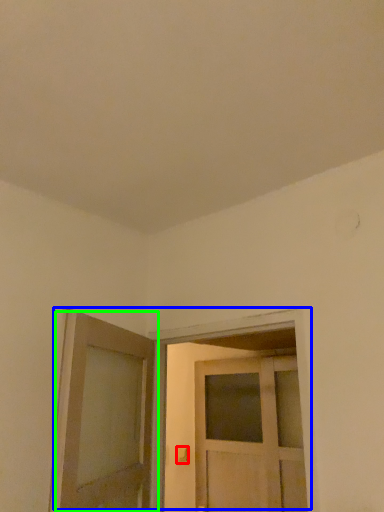
Question: Which is nearer to the door handle (highlighted by a red box)? door (highlighted by a blue box) or door (highlighted by a green box).

Choices:
 (A) door
 (B) door

Answer: (A)